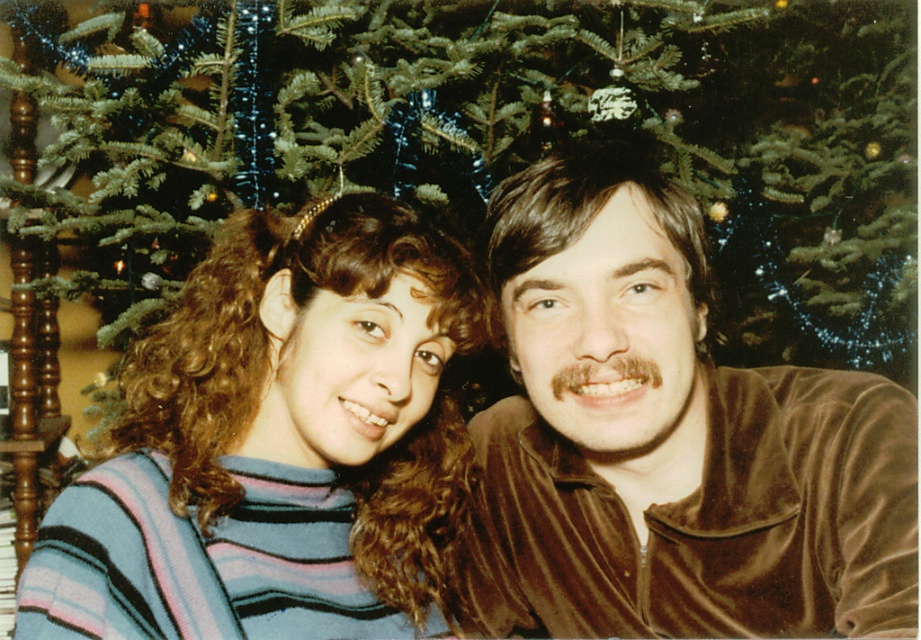
Does velvet brown shirt at center have a lesser width compared to striped sweater at center?

In fact, velvet brown shirt at center might be wider than striped sweater at center.

Is velvet brown shirt at center taller than striped sweater at center?

Yes, velvet brown shirt at center is taller than striped sweater at center.

Is point (799, 417) in front of point (76, 488)?

No, (799, 417) is behind (76, 488).

Find the location of a particular element. The height and width of the screenshot is (640, 921). velvet brown shirt at center is located at coordinates (667, 442).

How far apart are green matte christmas tree at center and velvet brown shirt at center?

The distance of green matte christmas tree at center from velvet brown shirt at center is 74.01 centimeters.

Which is in front, point (546, 131) or point (614, 378)?

Point (614, 378) is more forward.

Locate an element on the screen. The image size is (921, 640). green matte christmas tree at center is located at coordinates (504, 138).

Is green matte christmas tree at center positioned in front of striped sweater at center?

That is False.

Does green matte christmas tree at center appear under striped sweater at center?

Incorrect, green matte christmas tree at center is not positioned below striped sweater at center.

Is point (708, 17) more distant than point (360, 208)?

That is True.

You are a GUI agent. You are given a task and a screenshot of the screen. Output one action in this format:
    pyautogui.click(x=<x>, y=<y>)
    Task: Click on the green matte christmas tree at center
    Image resolution: width=921 pixels, height=640 pixels.
    Given the screenshot: What is the action you would take?
    pyautogui.click(x=504, y=138)